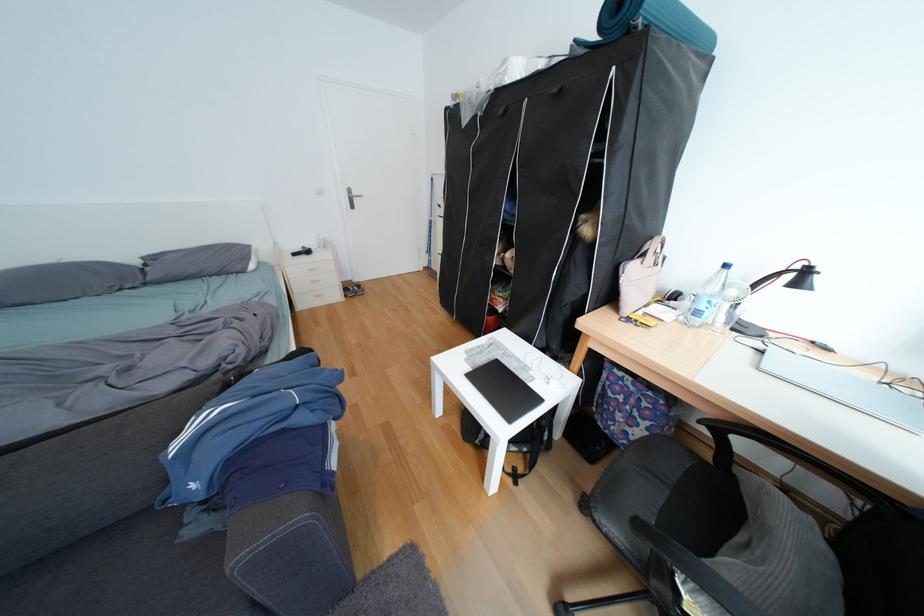
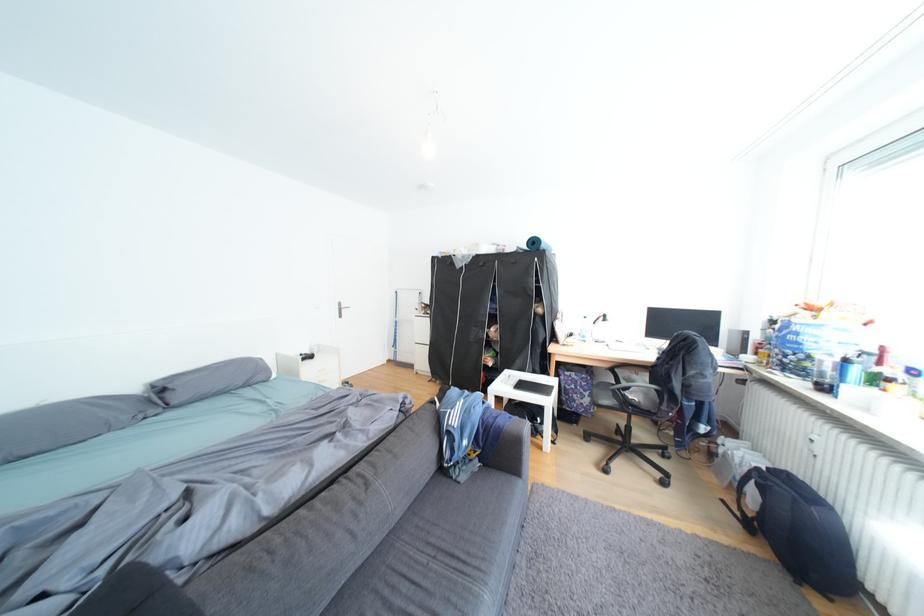
In the second image, find the point that corresponds to point 573,318 in the first image.

(552, 352)